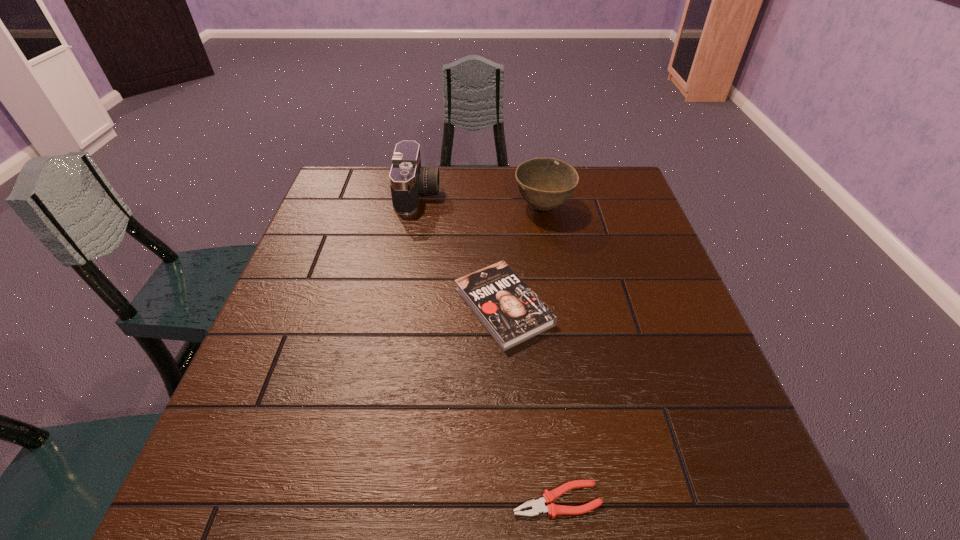
Where is `camera that is at the far edge`? This screenshot has width=960, height=540. camera that is at the far edge is located at coordinates (408, 180).

This screenshot has height=540, width=960. Find the location of `bowl present at the far edge`. bowl present at the far edge is located at coordinates (545, 183).

Identify the location of object that is positioned at the near edge. (538, 506).

The height and width of the screenshot is (540, 960). Identify the location of blank area at the far edge. (432, 202).

Find the location of a particular element. The image size is (960, 540). vacant space at the near edge of the desktop is located at coordinates (488, 491).

Find the location of a particular element. This screenshot has width=960, height=540. free space at the left edge of the desktop is located at coordinates (312, 295).

Find the location of a particular element. The image size is (960, 540). free spot at the right edge of the desktop is located at coordinates (652, 261).

The width and height of the screenshot is (960, 540). In the image, there is a desktop. Identify the location of blank space at the far right corner. (629, 178).

The image size is (960, 540). In order to click on vacant region at the near right corner of the desktop in this screenshot , I will do `click(695, 517)`.

Where is `free space between the second shortest object and the bowl`? free space between the second shortest object and the bowl is located at coordinates (523, 257).